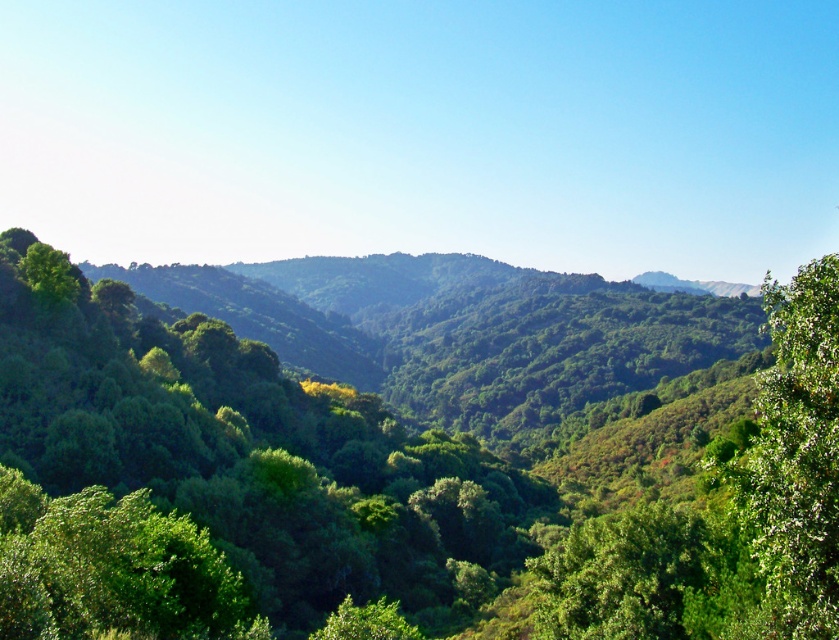
You are standing in the lush landscape and see the green leafy tree at center and the green leafy tree at right. Which tree is positioned more to the left side of the scene?

A: The green leafy tree at center is positioned more to the left side of the scene compared to the green leafy tree at right.

You are standing in the lush landscape and see a point marked at coordinates (378, 486). What object does this point correspond to?

The point at coordinates (378, 486) corresponds to the green leafy tree at center.